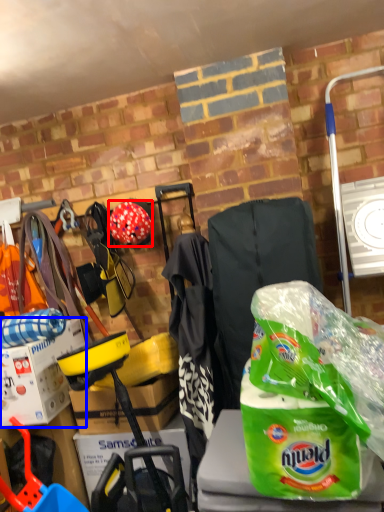
Question: Which of the following is the closest to the observer, helmet (highlighted by a red box) or box (highlighted by a blue box)?

Choices:
 (A) helmet
 (B) box

Answer: (B)